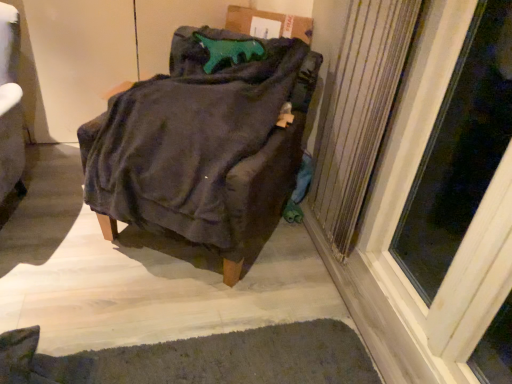
Question: In terms of width, does velvety dark gray chair at center look wider or thinner when compared to transparent glass screen door at right?

Choices:
 (A) wide
 (B) thin

Answer: (A)

Question: In the image, is velvety dark gray chair at center positioned in front of or behind transparent glass screen door at right?

Choices:
 (A) front
 (B) behind

Answer: (B)

Question: Considering the real-world distances, which object is closest to the transparent glass screen door at right?

Choices:
 (A) metallic silver radiator at right
 (B) velvety dark gray chair at center
 (C) dark gray textured mat at lower center

Answer: (A)

Question: Which object is the closest to the metallic silver radiator at right?

Choices:
 (A) velvety dark gray chair at center
 (B) dark gray textured mat at lower center
 (C) transparent glass screen door at right

Answer: (C)